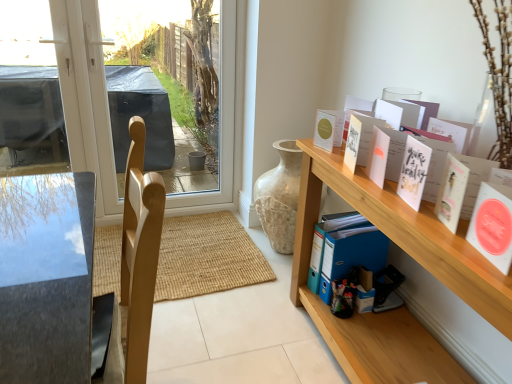
Question: Is matte white card at upper right, which is the 1th book from back to front, closer to camera compared to white paper card at upper right, arranged as the 3th book when viewed from the front?

Choices:
 (A) yes
 (B) no

Answer: (B)

Question: Is matte white card at upper right, the fourth book in the front-to-back sequence, smaller than white paper card at upper right, the second book when ordered from back to front?

Choices:
 (A) yes
 (B) no

Answer: (B)

Question: From a real-world perspective, is matte white card at upper right, the fourth book in the front-to-back sequence, on white paper card at upper right, the second book when ordered from back to front?

Choices:
 (A) no
 (B) yes

Answer: (A)

Question: From a real-world perspective, is matte white card at upper right, the fourth book in the front-to-back sequence, positioned under white paper card at upper right, arranged as the 3th book when viewed from the front, based on gravity?

Choices:
 (A) yes
 (B) no

Answer: (A)

Question: Is matte white card at upper right, the fourth book in the front-to-back sequence, looking in the opposite direction of white paper card at upper right, arranged as the 3th book when viewed from the front?

Choices:
 (A) no
 (B) yes

Answer: (A)

Question: Is matte white card at upper right, which is the 1th book from back to front, surrounding white paper card at upper right, the second book when ordered from back to front?

Choices:
 (A) no
 (B) yes

Answer: (A)

Question: Can you confirm if white paper card at upper right, marked as the 2th book in a front-to-back arrangement, is thinner than matte white card at upper right, which is the 1th book from back to front?

Choices:
 (A) no
 (B) yes

Answer: (A)

Question: Is matte white card at upper right, the fourth book in the front-to-back sequence, inside white paper card at upper right, marked as the 2th book in a front-to-back arrangement?

Choices:
 (A) no
 (B) yes

Answer: (A)

Question: From a real-world perspective, is white paper card at upper right, marked as the 2th book in a front-to-back arrangement, over matte white card at upper right, the fourth book in the front-to-back sequence?

Choices:
 (A) yes
 (B) no

Answer: (A)

Question: Is white paper card at upper right, the 3th book from the back, bigger than matte white card at upper right, which is the 1th book from back to front?

Choices:
 (A) no
 (B) yes

Answer: (B)

Question: Are white paper card at upper right, marked as the 2th book in a front-to-back arrangement, and matte white card at upper right, the fourth book in the front-to-back sequence, making contact?

Choices:
 (A) yes
 (B) no

Answer: (B)

Question: Does white paper card at upper right, the 3th book from the back, appear on the right side of matte white card at upper right, which is the 1th book from back to front?

Choices:
 (A) no
 (B) yes

Answer: (B)

Question: From a real-world perspective, is white matte cards at upper right, positioned as the fourth book in back-to-front order, below wooden shelf at right?

Choices:
 (A) no
 (B) yes

Answer: (A)